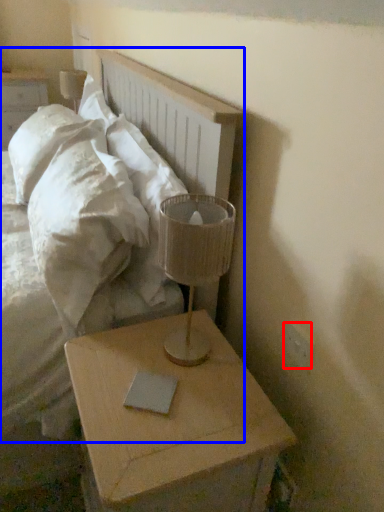
Question: Which object appears closest to the camera in this image, electric outlet (highlighted by a red box) or bed (highlighted by a blue box)?

Choices:
 (A) electric outlet
 (B) bed

Answer: (B)